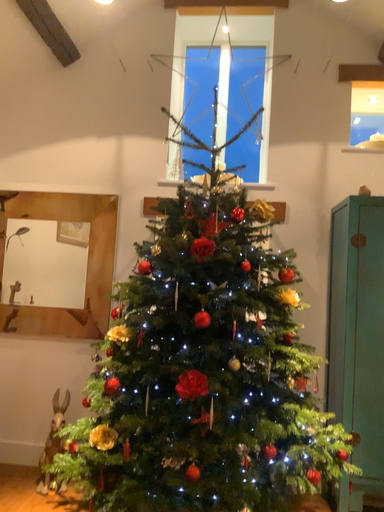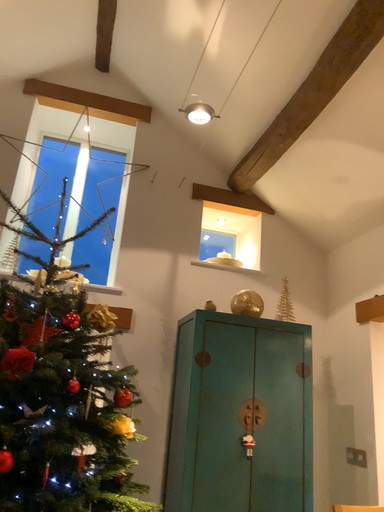
Question: How did the camera likely rotate when shooting the video?

Choices:
 (A) rotated upward
 (B) rotated downward

Answer: (A)